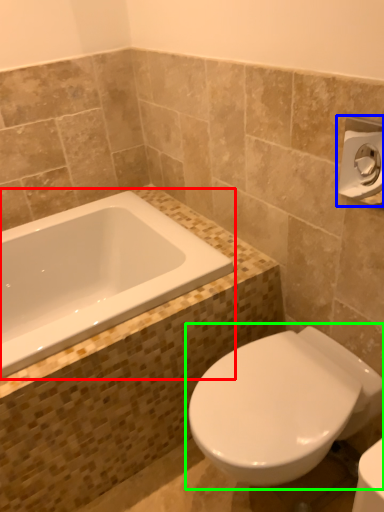
Question: Based on their relative distances, which object is nearer to bathtub (highlighted by a red box)? Choose from towel bar (highlighted by a blue box) and toilet (highlighted by a green box).

Choices:
 (A) towel bar
 (B) toilet

Answer: (B)